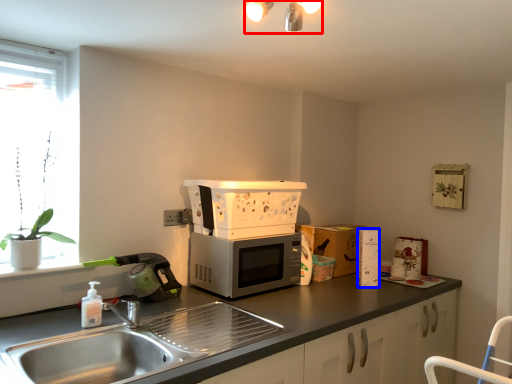
Question: Among these objects, which one is farthest to the camera, light fixture (highlighted by a red box) or appliance (highlighted by a blue box)?

Choices:
 (A) light fixture
 (B) appliance

Answer: (B)